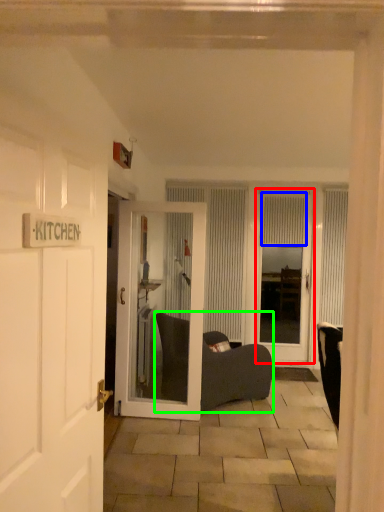
Question: Considering the real-world distances, which object is farthest from door (highlighted by a red box)? curtain (highlighted by a blue box) or furniture (highlighted by a green box)?

Choices:
 (A) curtain
 (B) furniture

Answer: (B)